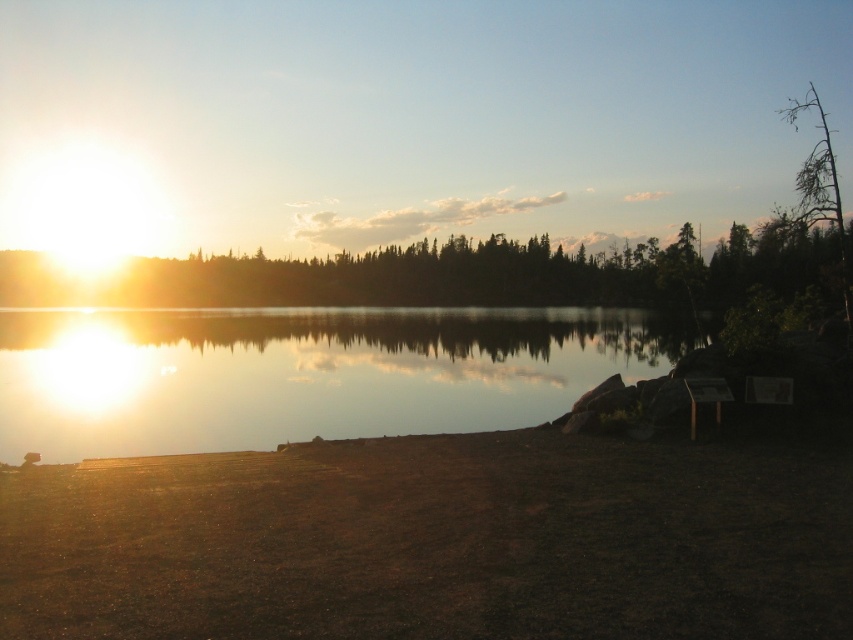
You are an observer standing at the lakeside. You see the glistening water at center and the green leafy tree at upper center. Which object is closer to you?

The glistening water at center is closer to the viewer than the green leafy tree at upper center.

You are standing at the lakeside and notice the glistening water at center and the green leafy tree at upper center. Which object is positioned to the left of the other?

The glistening water at center is to the left of green leafy tree at upper center.

You are standing at the camera position and want to reach the point marked as point (390, 424). If your walking speed is 1.5 meters per second, how many seconds will it take you to reach that point?

The distance between you and point (390, 424) is 19.54 meters. At a walking speed of 1.5 meters per second, it will take approximately 13.03 seconds to reach the point.